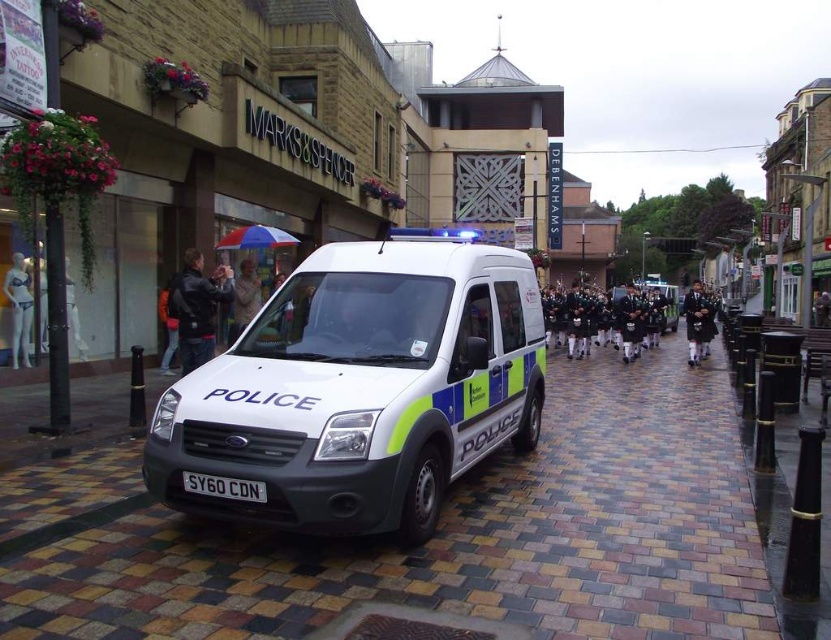
You are a photographer standing at the edge of the brick paved sidewalk at center. You want to take a photo of the white police van with

The brick paved sidewalk at center is 3.65 meters away from the camera, so you can easily capture the white police van with

You are a delivery person who needs to place a 2.5 meter long package between the brick paved sidewalk at center and the white matte mannequin at left. Can you fit the package in the space between them?

The brick paved sidewalk at center and white matte mannequin at left are 6.80 meters apart from each other. Since the package is 2.5 meters long, it can be placed between them as the distance between the two objects is greater than the package length.

You are a delivery person with a 1.2 meter wide cart. You need to move from your current position to the Marks and Spencer store on the left. Is there enough space on the brick paved sidewalk at center to move your cart through?

The brick paved sidewalk at center is 3.65 meters from the camera. Since the cart is only 1.2 meters wide, there is sufficient space for the cart to pass through the brick paved sidewalk at center as the distance is greater than the cart width.